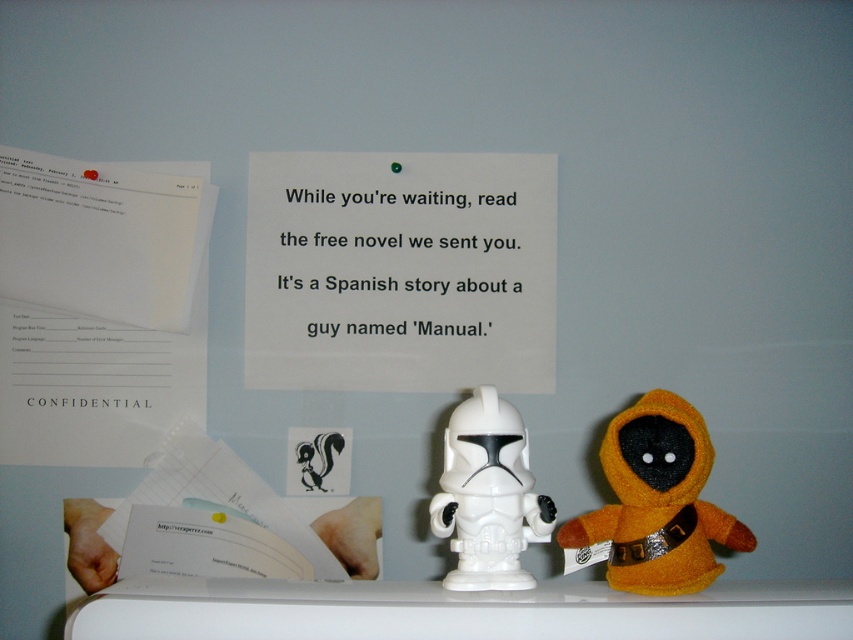
Question: Can you confirm if orange plush toy at center is thinner than white plastic toy at center?

Choices:
 (A) yes
 (B) no

Answer: (B)

Question: Does black paper at center appear over orange plush toy at center?

Choices:
 (A) no
 (B) yes

Answer: (B)

Question: Which of the following is the farthest from the observer?

Choices:
 (A) (619, 500)
 (B) (469, 547)

Answer: (A)

Question: Estimate the real-world distances between objects in this image. Which object is closer to the white plastic toy at center?

Choices:
 (A) orange plush toy at center
 (B) black paper at center

Answer: (A)

Question: Can you confirm if black paper at center is positioned below white plastic toy at center?

Choices:
 (A) no
 (B) yes

Answer: (A)

Question: Which object appears closest to the camera in this image?

Choices:
 (A) white plastic toy at center
 (B) black paper at center
 (C) orange plush toy at center

Answer: (C)